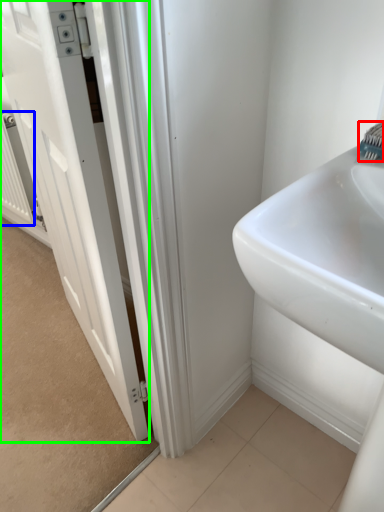
Question: Which object is the farthest from brush (highlighted by a red box)? Choose among these: radiator (highlighted by a blue box) or door (highlighted by a green box).

Choices:
 (A) radiator
 (B) door

Answer: (A)